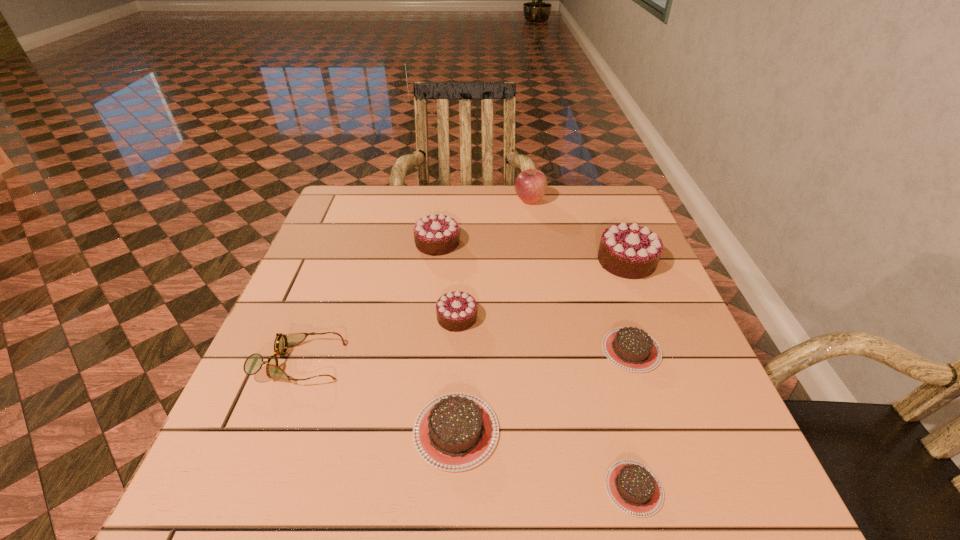
Find the location of a particular element. This screenshot has height=540, width=960. vacant point at the right edge is located at coordinates (719, 463).

The image size is (960, 540). In order to click on vacant space at the near left corner in this screenshot , I will do `click(240, 524)`.

Image resolution: width=960 pixels, height=540 pixels. Identify the location of vacant space at the far right corner. 600,222.

At what (x,y) coordinates should I click in order to perform the action: click on free point between the fourth tallest object and the tallest chocolate cake. Please return your answer as a coordinate pair (x, y). The width and height of the screenshot is (960, 540). Looking at the image, I should click on (541, 289).

Locate an element on the screen. vacant space that is in between the leftmost brown chocolate cake and the fourth shortest object is located at coordinates (377, 396).

This screenshot has height=540, width=960. In order to click on free area in between the leftmost brown chocolate cake and the fourth shortest chocolate cake in this screenshot , I will do `click(457, 374)`.

Identify the location of free space between the farthest object and the fifth tallest object. This screenshot has height=540, width=960. (414, 281).

The height and width of the screenshot is (540, 960). I want to click on free space between the shortest chocolate cake and the nearest chocolate chocolate cake, so click(545, 402).

You are a GUI agent. You are given a task and a screenshot of the screen. Output one action in this format:
    pyautogui.click(x=<x>, y=<y>)
    Task: Click on the vacant area that lies between the smallest chocolate chocolate cake and the fifth shortest chocolate cake
    The image size is (960, 540).
    Given the screenshot: What is the action you would take?
    pyautogui.click(x=447, y=280)

The image size is (960, 540). Find the location of `blank region between the fifth tallest object and the leftmost brown chocolate cake`. blank region between the fifth tallest object and the leftmost brown chocolate cake is located at coordinates (377, 396).